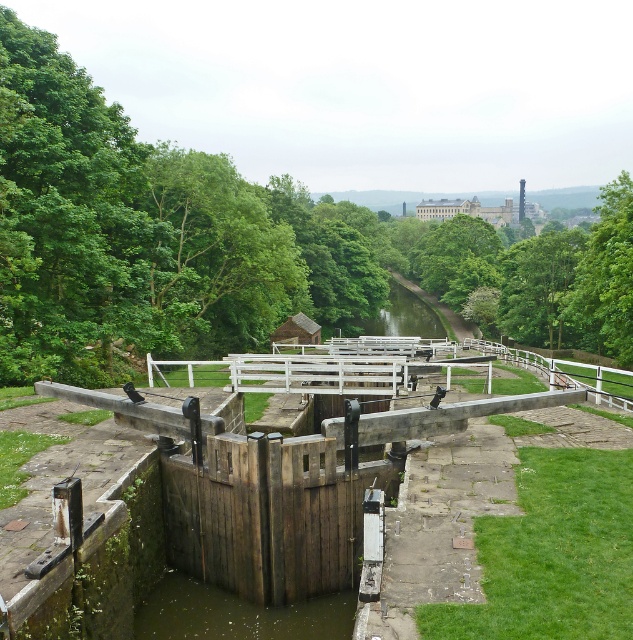
You are standing at the wooden gate of the lock chamber and want to determine the distance between two points marked in the image. The first point is at coordinates point (44, 205) and the second is at point (622, 205). Based on the scene description, which point is nearer to you?

Point (44, 205) is closer to the viewer than point (622, 205).

You are a photographer standing at the camera position. You want to capture a photo of the green leafy tree at upper right. Given that your camera has a maximum focus range of 90 feet, will you be able to focus on the tree?

The distance between the green leafy tree at upper right and the camera is 88.58 feet, which is within the camera maximum focus range of 90 feet. Therefore, you can focus on the green leafy tree at upper right.